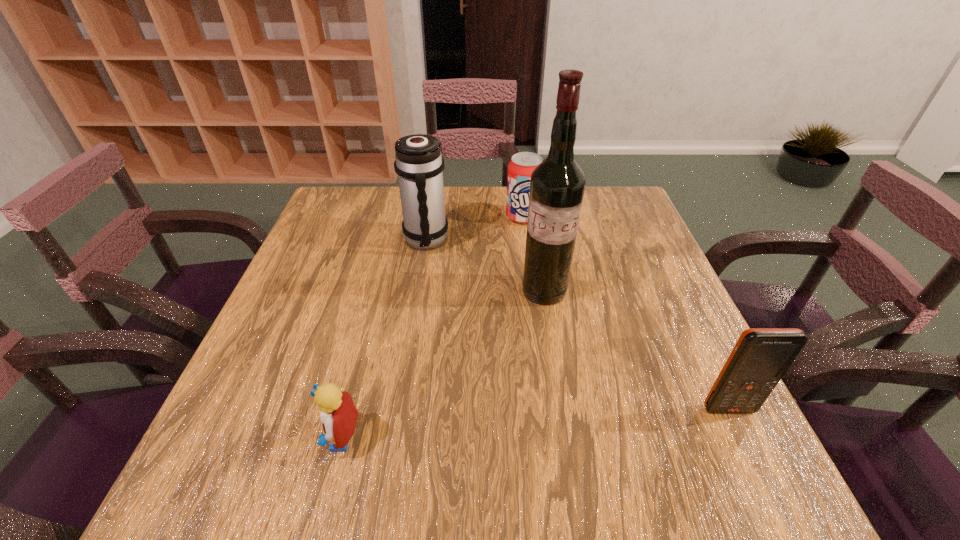
Choose which object is the third nearest neighbor to the wine bottle. Please provide its 2D coordinates. Your answer should be formatted as a tuple, i.e. [(x, y)], where the tuple contains the x and y coordinates of a point satisfying the conditions above.

[(761, 356)]